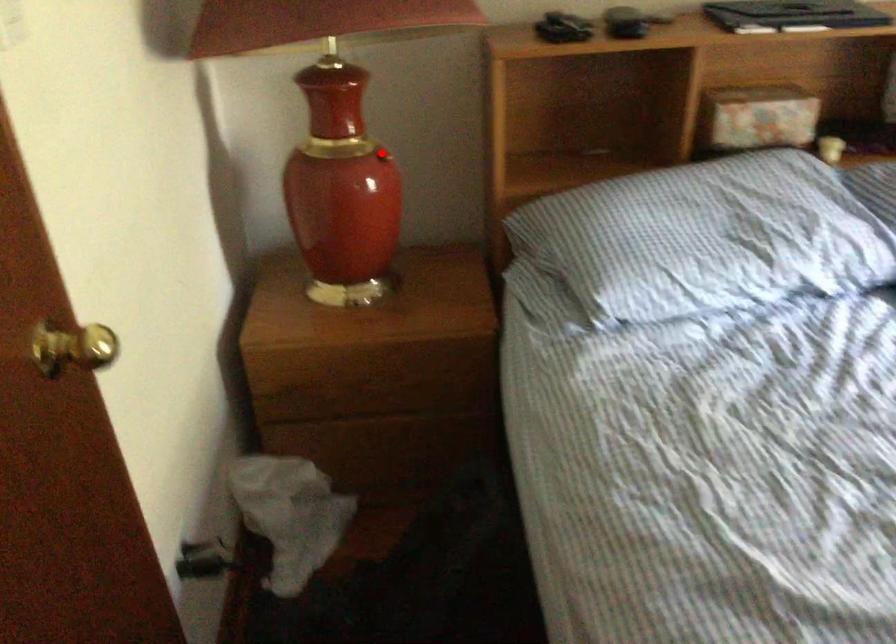
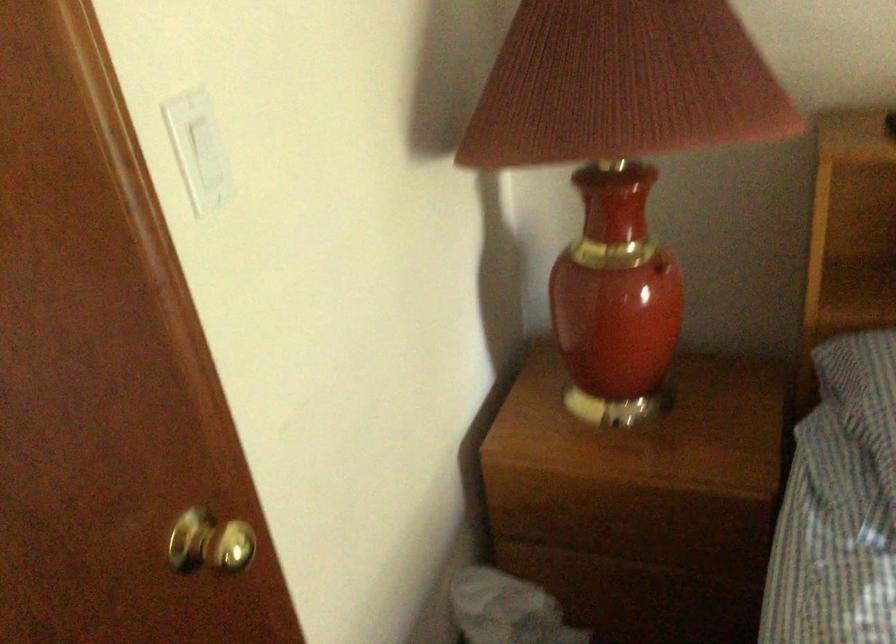
The point at the highlighted location is marked in the first image. Where is the corresponding point in the second image?

(661, 267)